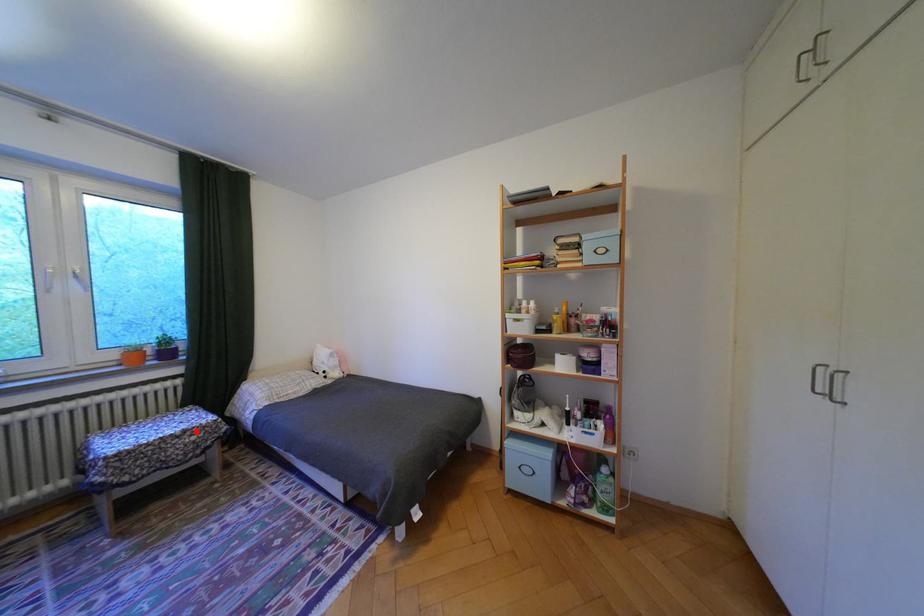
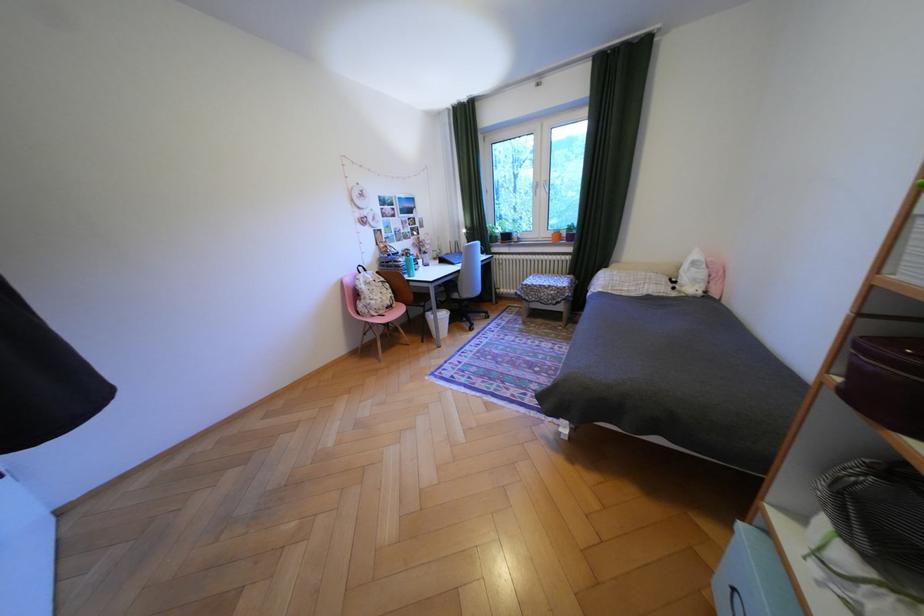
Find the pixel in the second image that matches the highlighted location in the first image.

(562, 286)